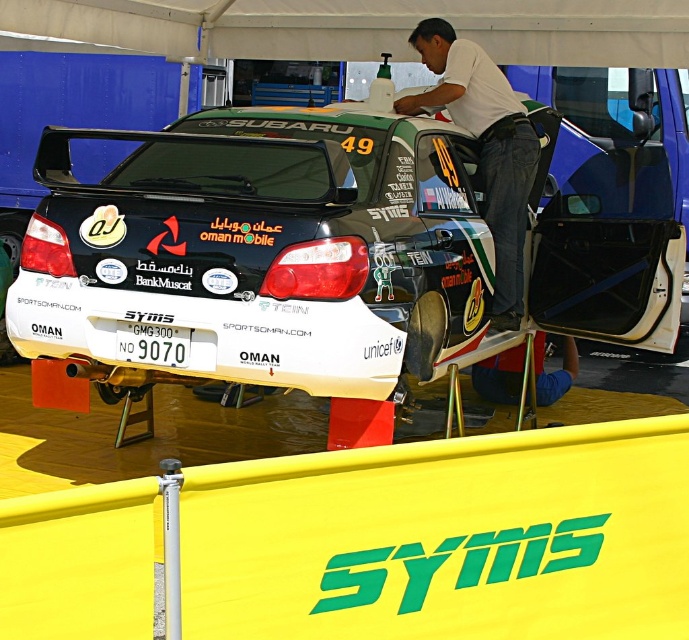
Consider the image. Who is positioned more to the left, white cotton shirt at upper center or white plastic license plate at center?

Positioned to the left is white plastic license plate at center.

What do you see at coordinates (484, 145) in the screenshot? I see `white cotton shirt at upper center` at bounding box center [484, 145].

Is point (444, 100) farther from viewer compared to point (167, 353)?

Yes, it is.

The image size is (689, 640). In order to click on white cotton shirt at upper center in this screenshot , I will do `click(484, 145)`.

Does white glossy rally car at center have a greater height compared to white cotton shirt at upper center?

No, white glossy rally car at center is not taller than white cotton shirt at upper center.

Between white glossy rally car at center and white cotton shirt at upper center, which one is positioned higher?

white cotton shirt at upper center

What are the coordinates of `white glossy rally car at center` in the screenshot? It's located at (322, 250).

How distant is white glossy rally car at center from white plastic license plate at center?

The distance of white glossy rally car at center from white plastic license plate at center is 34.90 inches.

Who is lower down, white glossy rally car at center or white plastic license plate at center?

white plastic license plate at center is lower down.

At what (x,y) coordinates should I click in order to perform the action: click on white glossy rally car at center. Please return your answer as a coordinate pair (x, y). Image resolution: width=689 pixels, height=640 pixels. Looking at the image, I should click on (322, 250).

At what (x,y) coordinates should I click in order to perform the action: click on white glossy rally car at center. Please return your answer as a coordinate pair (x, y). Image resolution: width=689 pixels, height=640 pixels. Looking at the image, I should click on (322, 250).